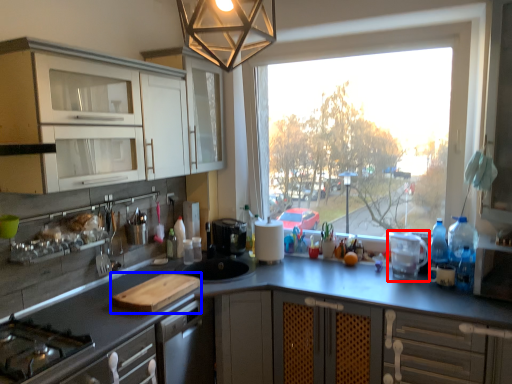
Question: Among these objects, which one is nearest to the camera, appliance (highlighted by a red box) or cutting board (highlighted by a blue box)?

Choices:
 (A) appliance
 (B) cutting board

Answer: (B)